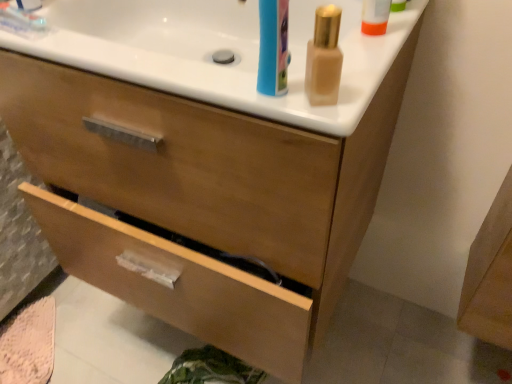
Question: From a real-world perspective, is satin gold bottle at upper right on wooden drawer at lower center, which ranks as the 2th drawer in top-to-bottom order?

Choices:
 (A) no
 (B) yes

Answer: (B)

Question: Is satin gold bottle at upper right shorter than wooden drawer at lower center, which ranks as the 2th drawer in top-to-bottom order?

Choices:
 (A) yes
 (B) no

Answer: (B)

Question: Considering the relative sizes of satin gold bottle at upper right and wooden drawer at lower center, which ranks as the 2th drawer in top-to-bottom order, in the image provided, is satin gold bottle at upper right taller than wooden drawer at lower center, which ranks as the 2th drawer in top-to-bottom order,?

Choices:
 (A) no
 (B) yes

Answer: (B)

Question: Is satin gold bottle at upper right at the left side of wooden drawer at lower center, which ranks as the 2th drawer in top-to-bottom order?

Choices:
 (A) no
 (B) yes

Answer: (A)

Question: From the image's perspective, is satin gold bottle at upper right on top of wooden drawer at lower center, which ranks as the 2th drawer in top-to-bottom order?

Choices:
 (A) no
 (B) yes

Answer: (B)

Question: Is wooden drawer at lower center, which ranks as the 2th drawer in top-to-bottom order, surrounded by satin gold bottle at upper right?

Choices:
 (A) no
 (B) yes

Answer: (A)

Question: Is satin gold bottle at upper right next to white glossy counter top at upper center?

Choices:
 (A) yes
 (B) no

Answer: (B)

Question: From a real-world perspective, is satin gold bottle at upper right located higher than white glossy counter top at upper center?

Choices:
 (A) yes
 (B) no

Answer: (A)

Question: Is satin gold bottle at upper right closer to camera compared to white glossy counter top at upper center?

Choices:
 (A) yes
 (B) no

Answer: (A)

Question: Is satin gold bottle at upper right bigger than white glossy counter top at upper center?

Choices:
 (A) yes
 (B) no

Answer: (B)

Question: From the image's perspective, would you say satin gold bottle at upper right is positioned over white glossy counter top at upper center?

Choices:
 (A) no
 (B) yes

Answer: (A)

Question: Is the position of satin gold bottle at upper right more distant than that of white glossy counter top at upper center?

Choices:
 (A) no
 (B) yes

Answer: (A)

Question: Is wooden drawer at lower center, the first drawer when ordered from bottom to top, positioned beyond the bounds of white glossy counter top at upper center?

Choices:
 (A) no
 (B) yes

Answer: (B)